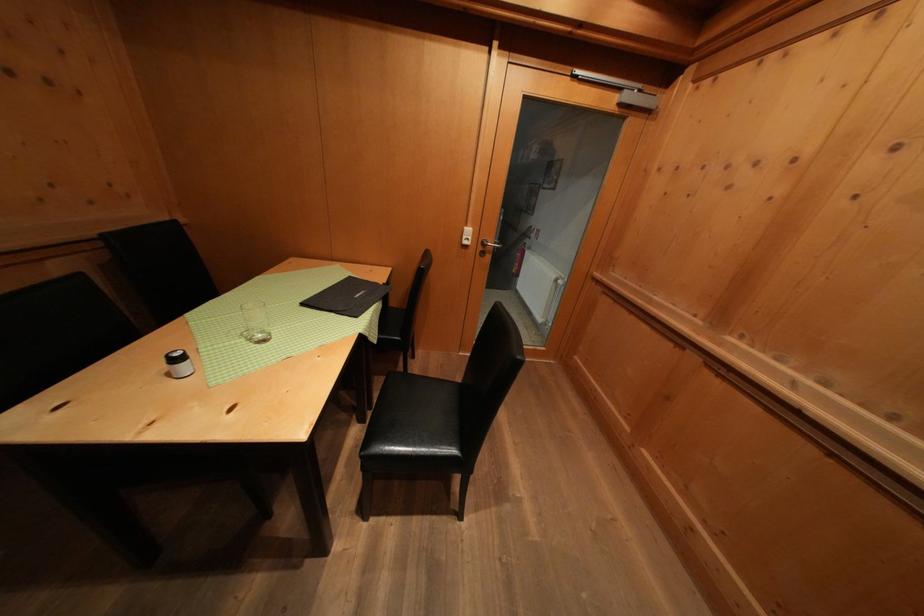
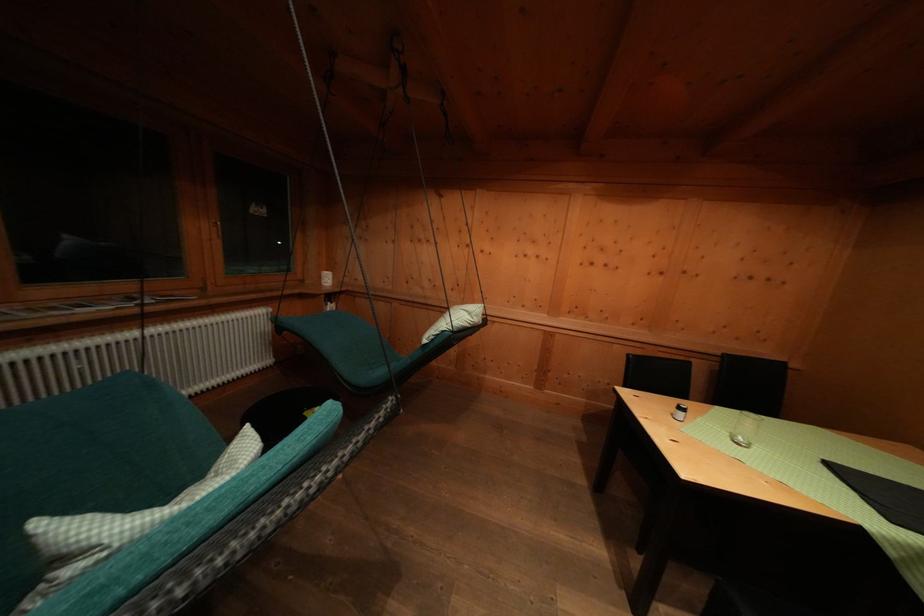
In the second image, find the point that corresponds to [183,365] in the first image.

(687, 413)